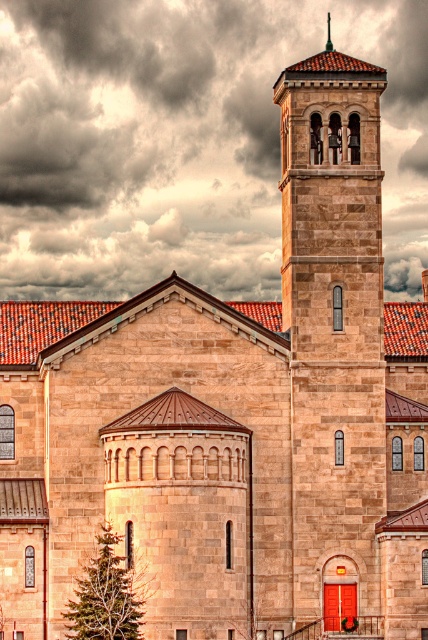
You are an architect analyzing the church design. You notice the dark gray cloud at upper center and the gold textured cross at upper center. Which object is positioned higher in the sky?

The gold textured cross at upper center is positioned higher than the dark gray cloud at upper center because the cloud is located below it.

You are an architect reviewing the church design. You notice the dark gray cloud at upper center in the image. Based on its coordinates, is it positioned closer to the top or the bottom of the image?

The dark gray cloud at upper center is located at point 0.219 on the x and 0.428 on the y. Since the y coordinate is 0.428, which is closer to 0.5 than 0, it is positioned closer to the top of the image.

In the scene shown: You are standing in front of the church and looking at the sky. You see the dark gray cloud at upper center and the gold textured cross at upper center. Which object is positioned more to the left?

The dark gray cloud at upper center is positioned more to the left than the gold textured cross at upper center according to the description.